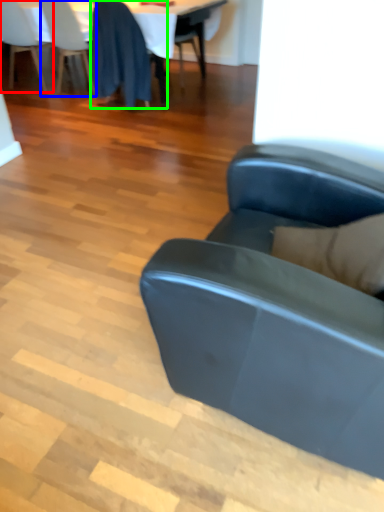
Question: Estimate the real-world distances between objects in this image. Which object is closer to chair (highlighted by a red box), chair (highlighted by a blue box) or chair (highlighted by a green box)?

Choices:
 (A) chair
 (B) chair

Answer: (A)